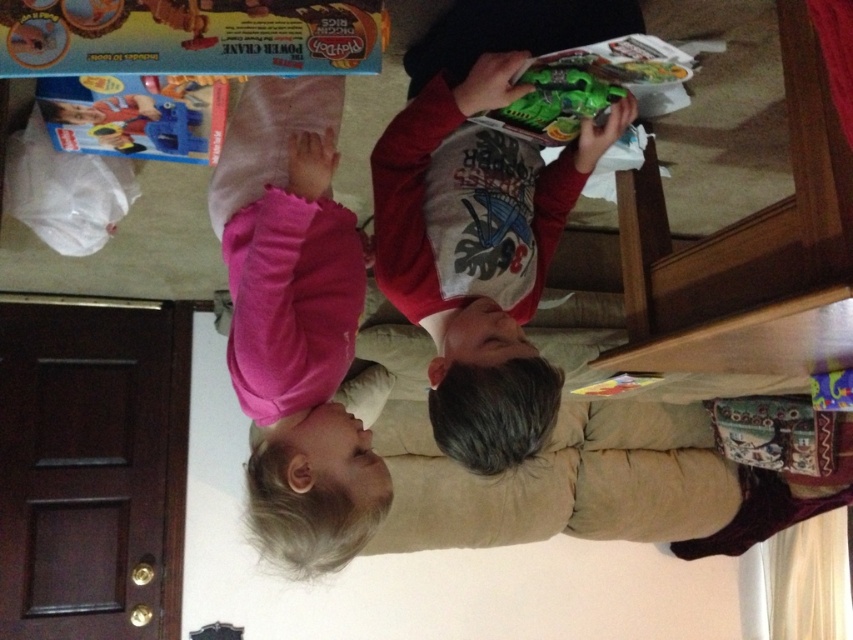
You are a parent trying to organize toys on the couch. You see the matte red shirt at center and the green matte toy gun at upper center. Which object is positioned to the right side?

The green matte toy gun at upper center is positioned to the right of the matte red shirt at center.